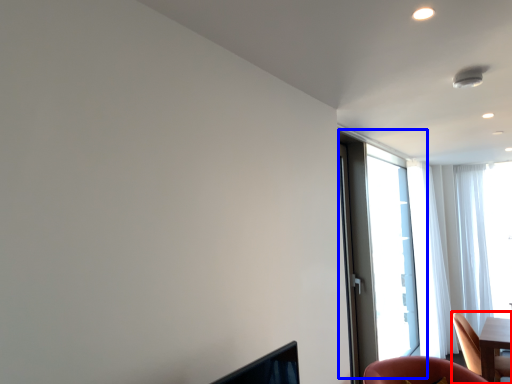
Question: Which point is closer to the camera, chair (highlighted by a red box) or window (highlighted by a blue box)?

Choices:
 (A) chair
 (B) window

Answer: (A)